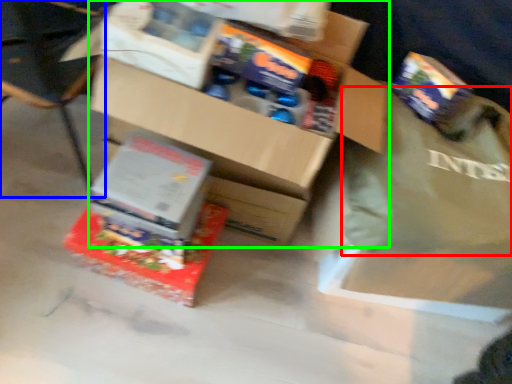
Question: Considering the real-world distances, which object is farthest from tote bag (highlighted by a red box)? chair (highlighted by a blue box) or box (highlighted by a green box)?

Choices:
 (A) chair
 (B) box

Answer: (A)